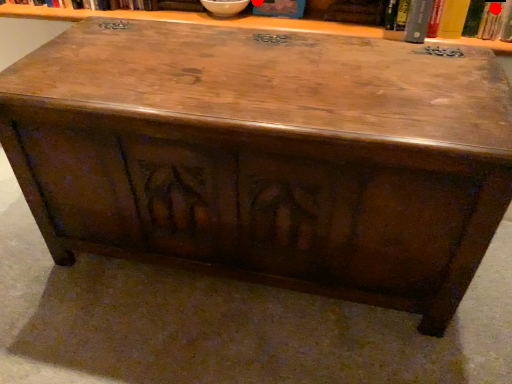
Question: Two points are circled on the image, labeled by A and B beside each circle. Among these points, which one is farthest from the camera?

Choices:
 (A) A is further
 (B) B is further

Answer: (A)